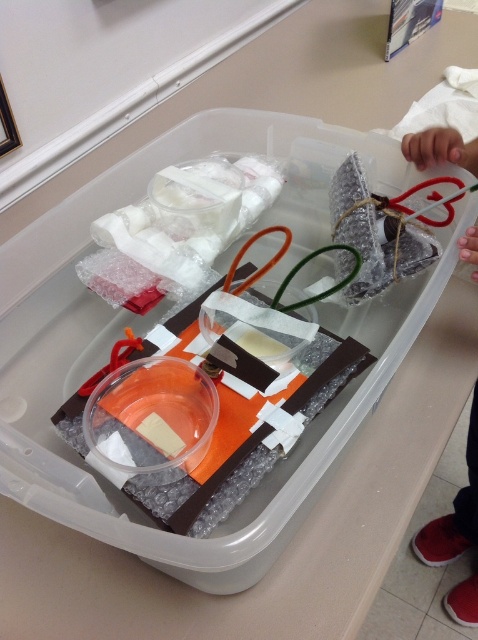
You are packing a box and need to place the matte plastic heart at upper right closer to the white bubble wrap at center. The minimum distance required between them is 20 inches. Is the current distance sufficient?

The white bubble wrap at center is currently 25.63 inches away from the matte plastic heart at upper right, which exceeds the minimum required distance of 20 inches. Therefore, the current distance is sufficient.

You are organizing a storage container and need to know which item is taller. You see the white bubble wrap at center and the matte plastic heart at upper right. Which one is taller?

The matte plastic heart at upper right is taller than the white bubble wrap at center.